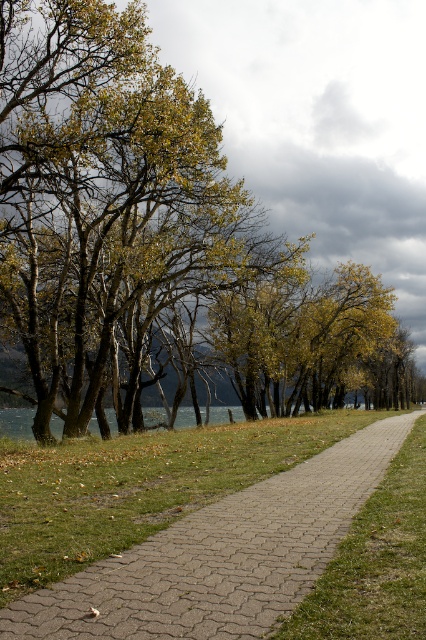
Question: Does green leafy tree at center lie behind pebble gray pavement at center?

Choices:
 (A) no
 (B) yes

Answer: (B)

Question: Is green leafy tree at center bigger than pebble gray pavement at center?

Choices:
 (A) yes
 (B) no

Answer: (A)

Question: Does green leafy tree at center have a greater width compared to pebble gray pavement at center?

Choices:
 (A) no
 (B) yes

Answer: (B)

Question: Among these points, which one is nearest to the camera?

Choices:
 (A) (140, 566)
 (B) (124, 401)

Answer: (A)